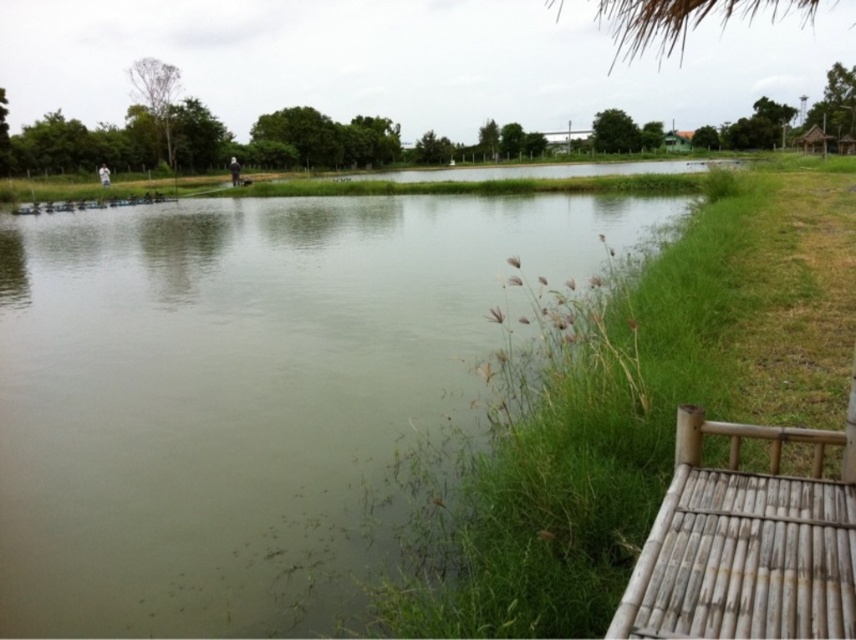
You are standing at the edge of the pond and see two points marked in the scene. The first point is at coordinates point (811, 129) and the second is at point (684, 148). Which of these two points is closer to you?

Point (811, 129) is in front of point (684, 148), so it is closer to you.

You are a visitor in this peaceful outdoor area and want to take a photo of the green grass at center and the green wooden hut at upper right. Where should you position yourself to capture both elements in the frame?

The green grass at center is below the green wooden hut at upper right, so positioning yourself at a lower viewpoint, such as crouching or standing closer to the grass level, would allow you to include both the green grass at center and the green wooden hut at upper right in your photo.

You are standing in the grassy area and want to walk to the brown wooden hut at right. Is the green wooden hut at upper right blocking your path?

The brown wooden hut at right is positioned under the green wooden hut at upper right, so the green wooden hut at upper right is blocking the path to the brown wooden hut at right.